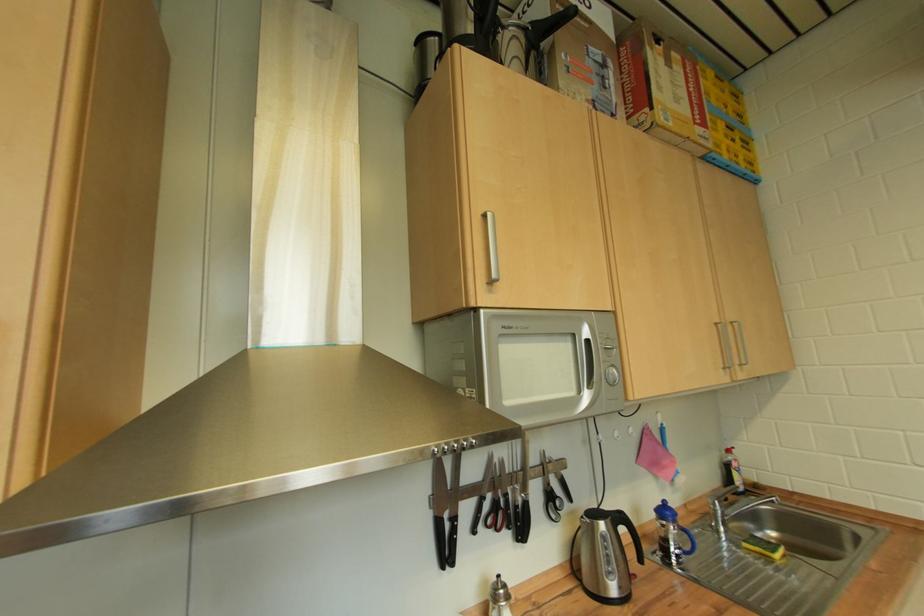
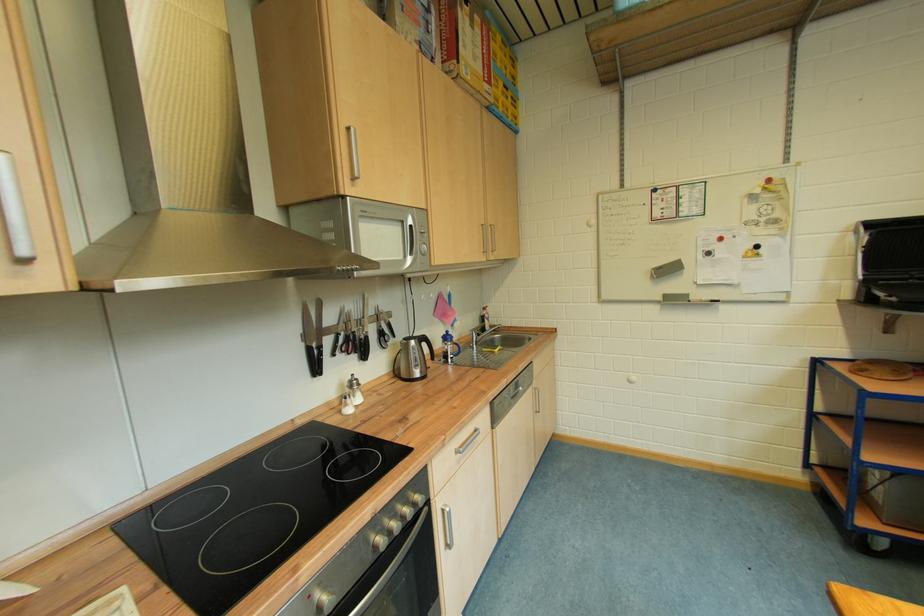
Where in the second image is the point corresponding to [721,508] from the first image?

(480, 336)